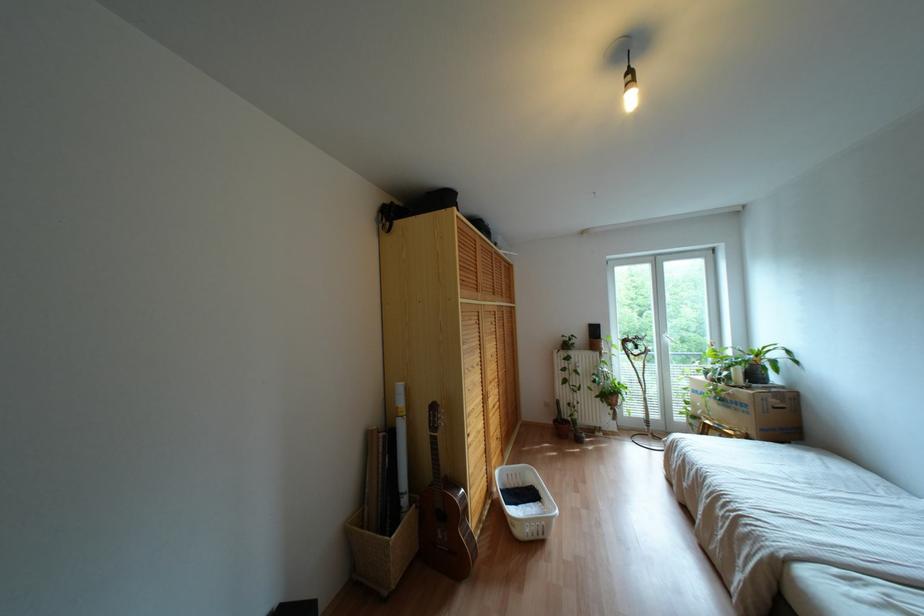
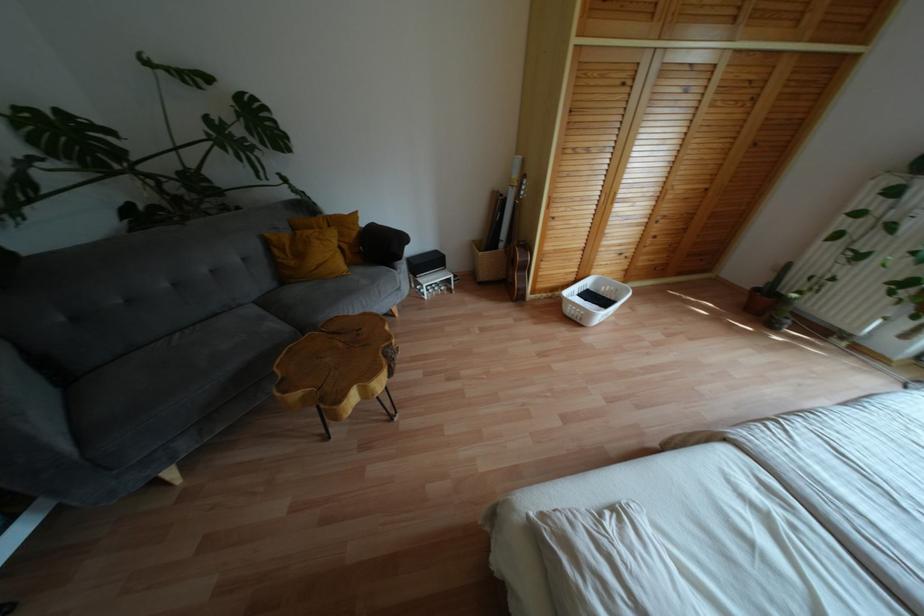
The point at (x=535, y=537) is marked in the first image. Where is the corresponding point in the second image?

(573, 318)